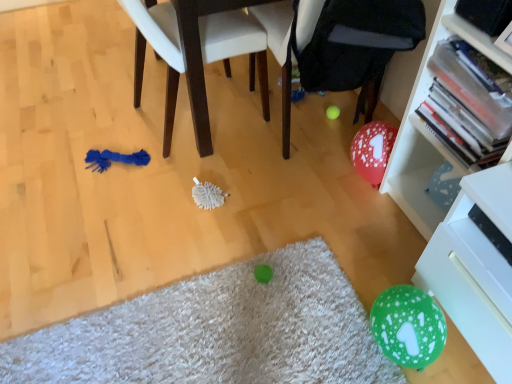
I want to click on free space in front of blue fabric chair at left, so click(186, 194).